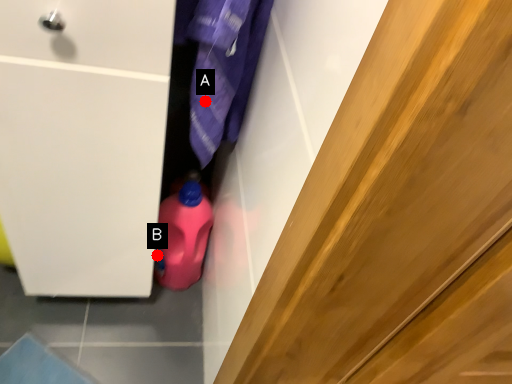
Question: Two points are circled on the image, labeled by A and B beside each circle. Which point is further to the camera?

Choices:
 (A) A is further
 (B) B is further

Answer: (B)